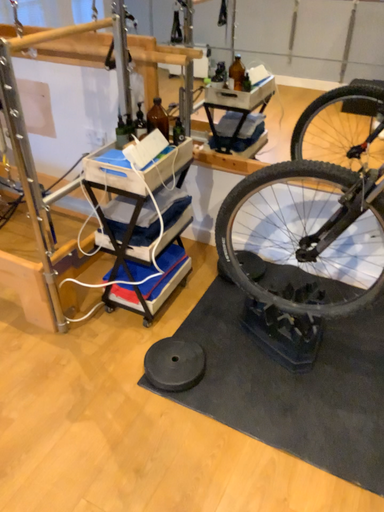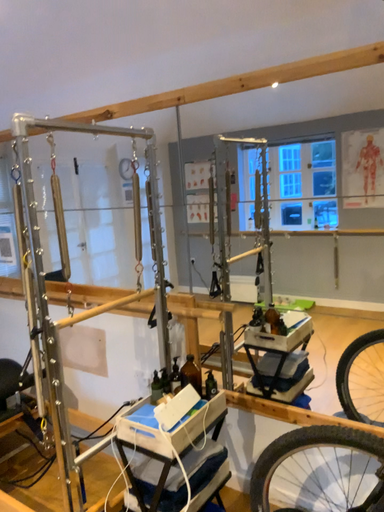
Question: Which way did the camera rotate in the video?

Choices:
 (A) rotated left
 (B) rotated right

Answer: (A)